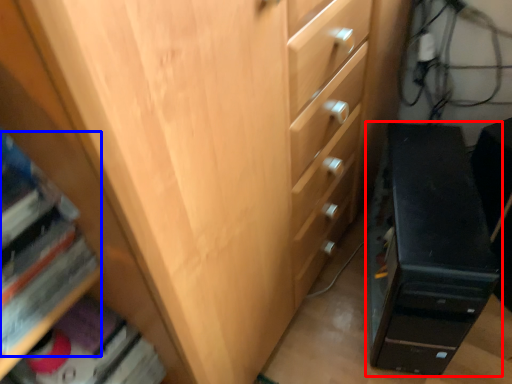
Question: Which of the following is the farthest to the observer, chest of drawers (highlighted by a red box) or book (highlighted by a blue box)?

Choices:
 (A) chest of drawers
 (B) book

Answer: (A)